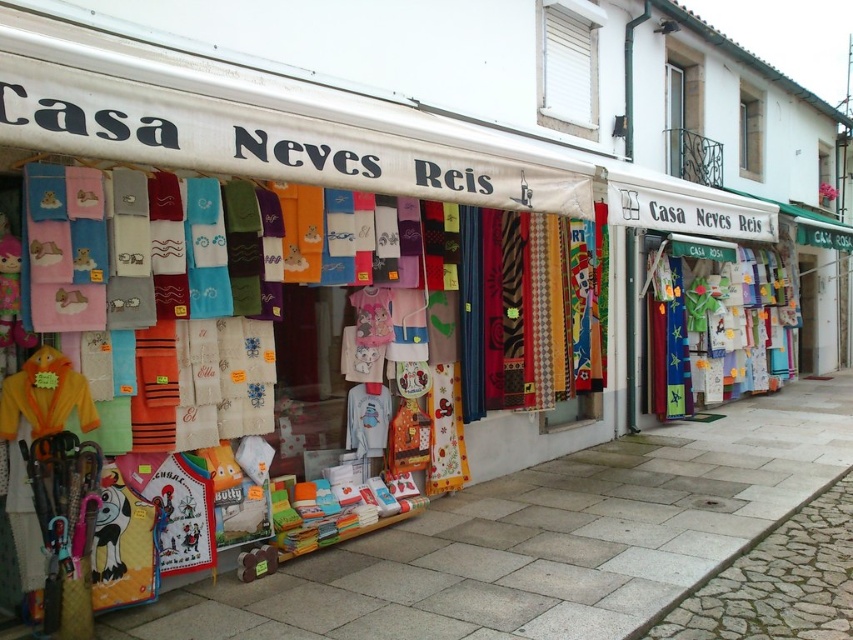
Which is more to the right, smooth stone pavement at lower center or transparent glass window at upper center?

transparent glass window at upper center is more to the right.

Is point (521, 595) closer to camera compared to point (755, 131)?

Yes, point (521, 595) is in front of point (755, 131).

This screenshot has height=640, width=853. Identify the location of smooth stone pavement at lower center. (544, 540).